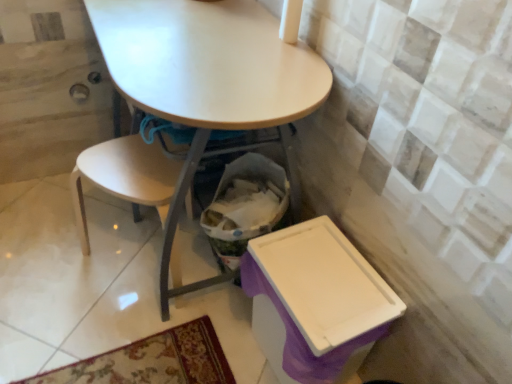
Question: Is matte white table at center to the left or to the right of light wood chair at lower left in the image?

Choices:
 (A) right
 (B) left

Answer: (A)

Question: Is matte white table at center inside or outside of light wood chair at lower left?

Choices:
 (A) outside
 (B) inside

Answer: (A)

Question: Considering the real-world distances, which object is closest to the light wood chair at lower left?

Choices:
 (A) purple plastic box at lower right
 (B) matte white table at center

Answer: (B)

Question: Which object is the farthest from the purple plastic box at lower right?

Choices:
 (A) matte white table at center
 (B) light wood chair at lower left

Answer: (B)